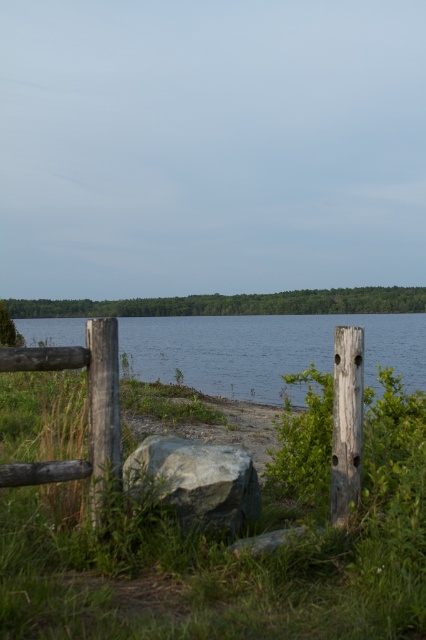
You are planning to place a small garden ornament between the weathered wood fence at center and the gray rough rock at center. Based on their sizes, which object should you position closer to the ornament to ensure it doesn

The weathered wood fence at center has a smaller size compared to the gray rough rock at center. Therefore, to ensure the ornament is appropriately sized, it should be placed closer to the weathered wood fence at center so it doesn

You are a painter standing at the lakeside. You want to paint the weathered wood fence at center and the gray rough rock at center. Which object should you focus on first if you want to paint the taller one first?

The weathered wood fence at center is much taller than the gray rough rock at center, so you should focus on painting the weathered wood fence at center first.

You are standing at the point marked by the coordinates point (265, 349). Based on the scene description, what type of terrain are you currently standing on?

The point (265, 349) is on clear water at center, so you are standing on clear water.